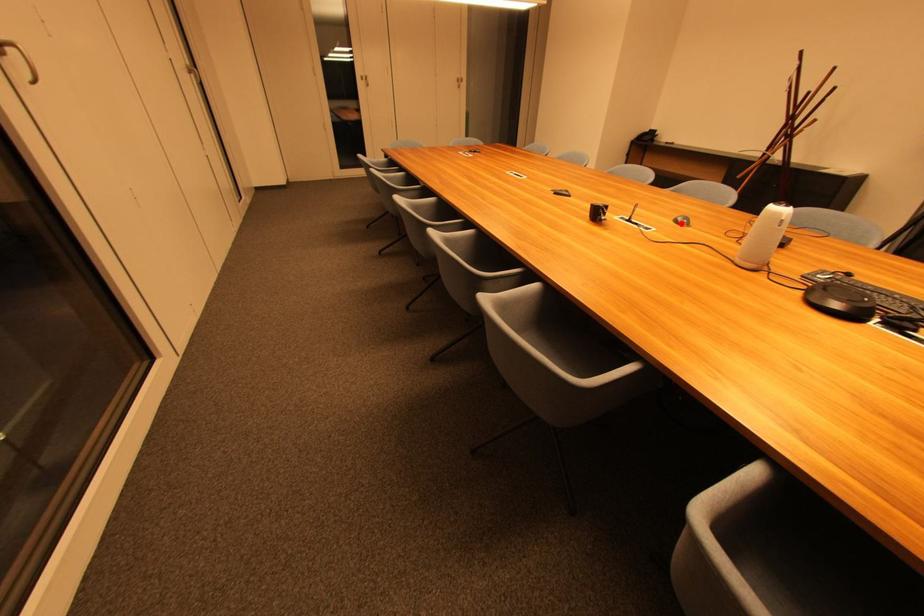
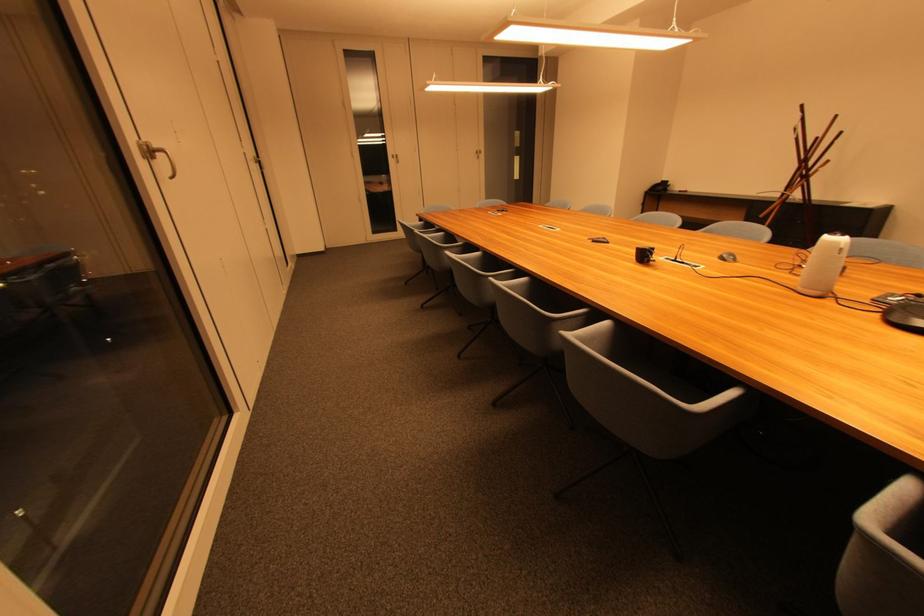
Where in the second image is the point corresponding to the highlighted location from the first image?

(726, 261)